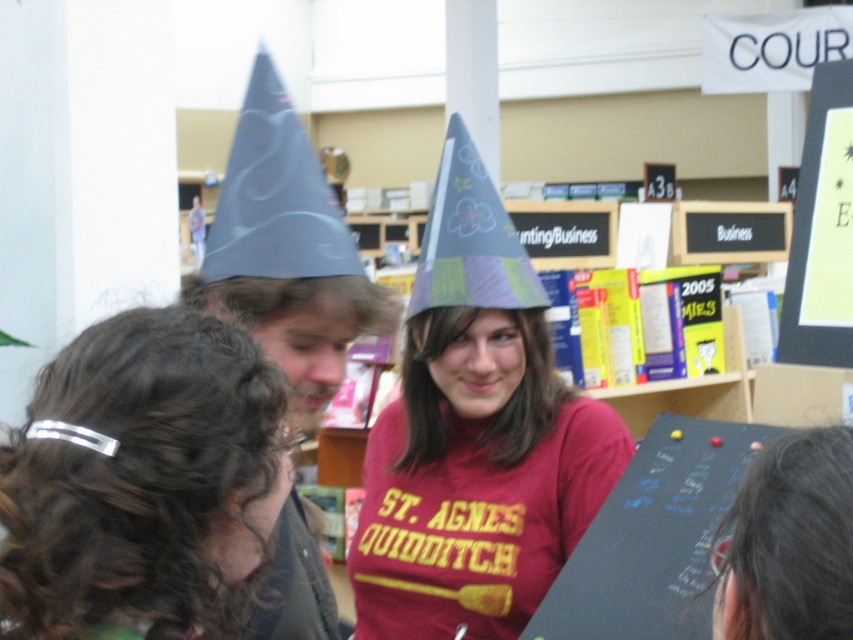
You are organizing a photo shoot in the described scene and need to ensure the silver metallic hair clip at center and the matte black sign at upper right are visible in the frame. Based on their positions, which object should you adjust to keep both in view?

The silver metallic hair clip at center is positioned on the left side of matte black sign at upper right. To keep both in view, you should adjust the matte black sign at upper right to ensure it doesn not block the silver metallic hair clip at center.